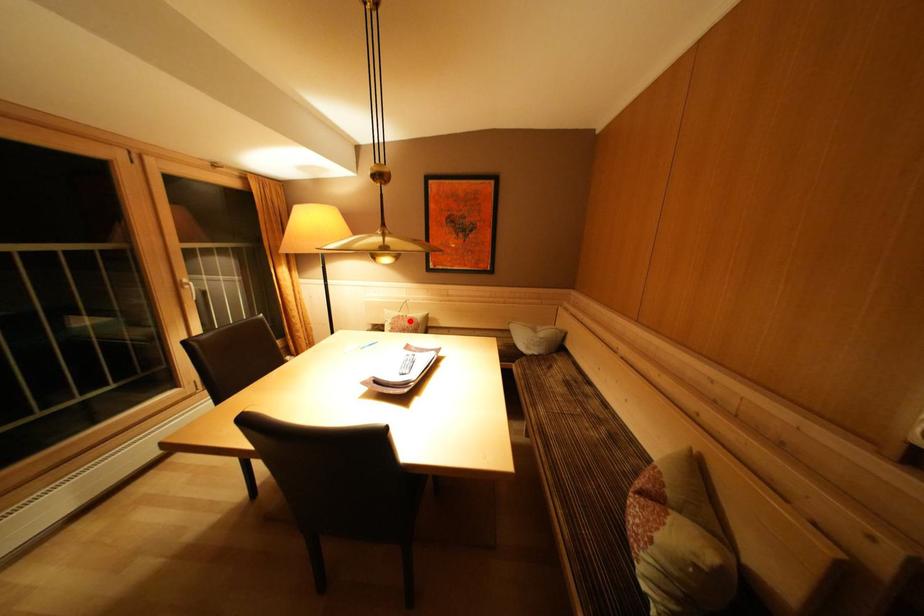
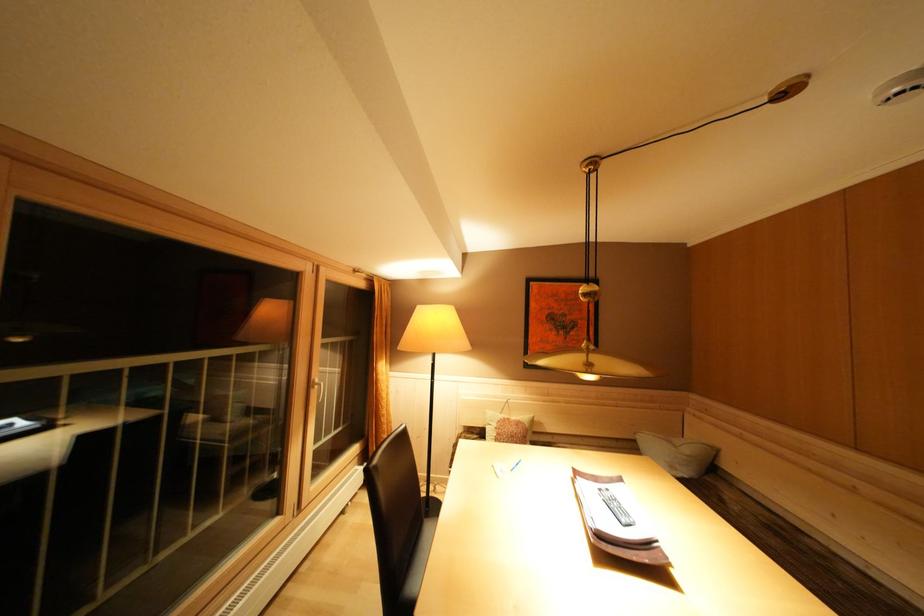
Question: I am providing you with two images of the same scene from different viewpoints. Image1 has a red point marked. In image2, the corresponding 3D location appears at what relative position? Reply with the corresponding letter.

Choices:
 (A) Closer
 (B) Farther

Answer: (B)